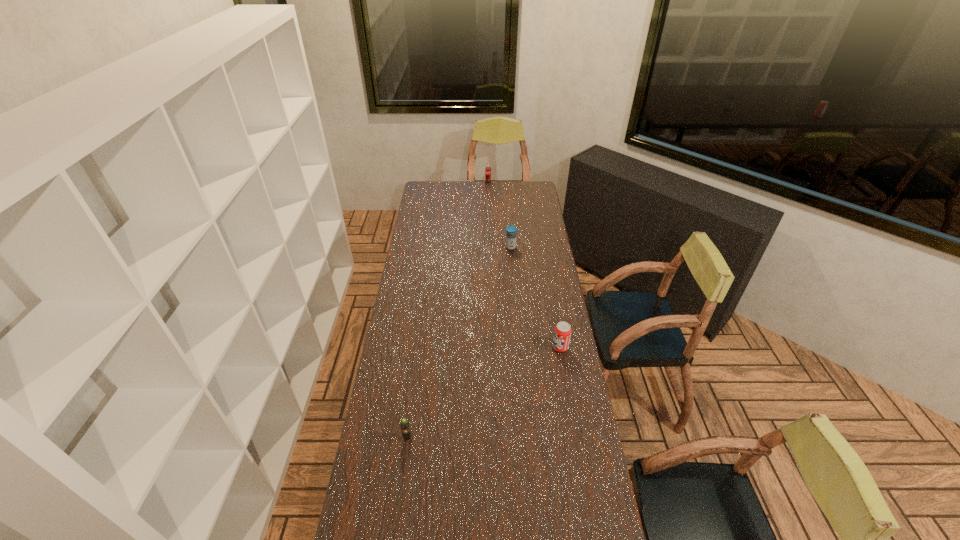
The width and height of the screenshot is (960, 540). I want to click on object that can be found as the closest to the farthest object, so click(x=511, y=236).

Select which object is the third closest to the third object from right to left. Please provide its 2D coordinates. Your answer should be formatted as a tuple, i.e. [(x, y)], where the tuple contains the x and y coordinates of a point satisfying the conditions above.

[(405, 428)]

Find the location of a particular element. Image resolution: width=960 pixels, height=540 pixels. the second closest soda to the second nearest object is located at coordinates (488, 170).

Identify the location of soda identified as the second closest to the leftmost soda. This screenshot has width=960, height=540. (488, 170).

At what (x,y) coordinates should I click in order to perform the action: click on free location that satisfies the following two spatial constraints: 1. on the label of the medicine; 2. on the left side of the tallest soda. Please return your answer as a coordinate pair (x, y). The height and width of the screenshot is (540, 960). Looking at the image, I should click on (490, 247).

Where is `vacant space that satisfies the following two spatial constraints: 1. on the label of the third nearest object; 2. on the left side of the farthest soda`? The image size is (960, 540). vacant space that satisfies the following two spatial constraints: 1. on the label of the third nearest object; 2. on the left side of the farthest soda is located at coordinates (490, 247).

I want to click on free region that satisfies the following two spatial constraints: 1. on the label of the medicine; 2. on the left side of the farthest object, so click(490, 247).